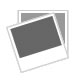
Find the location of a particular element. The width and height of the screenshot is (80, 80). gray picture is located at coordinates (36, 35), (59, 22).